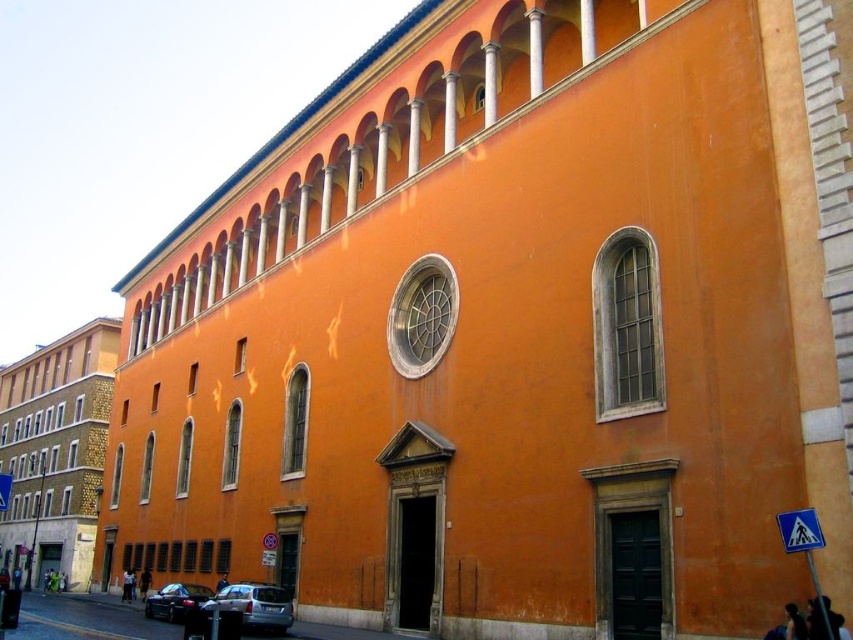
You are standing in front of the orange building and want to pick up both the dark blue fabric at lower right and the dark brown leather jacket at lower left. Which object should you reach for first based on their positions?

The dark blue fabric at lower right is closer to the viewer than the dark brown leather jacket at lower left, so you should reach for the dark blue fabric at lower right first.

You are a delivery person trying to park your silver metallic car at lower left. The parking spot is marked by the dark blue fabric at center. Can your car fit into the parking spot?

The silver metallic car at lower left might be wider than dark blue fabric at center, so there is a possibility that the car may not fit into the parking spot. It is recommended to check the width of the parking spot before attempting to park.